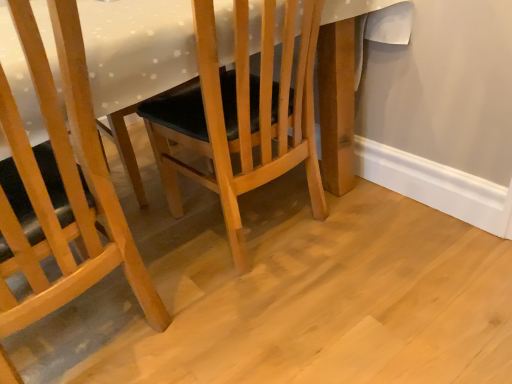
Find the location of `vacant area that lies between matte wood chair at center, the second chair in the right-to-left sequence, and wooden chair at center, which is the first chair from right to left`. vacant area that lies between matte wood chair at center, the second chair in the right-to-left sequence, and wooden chair at center, which is the first chair from right to left is located at coordinates (194, 283).